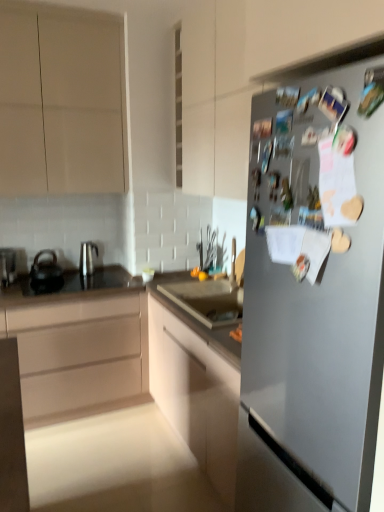
What are the coordinates of `vacant space to the right of satin silver kettle at left, which ranks as the second tea pot in left-to-right order` in the screenshot? It's located at (110, 277).